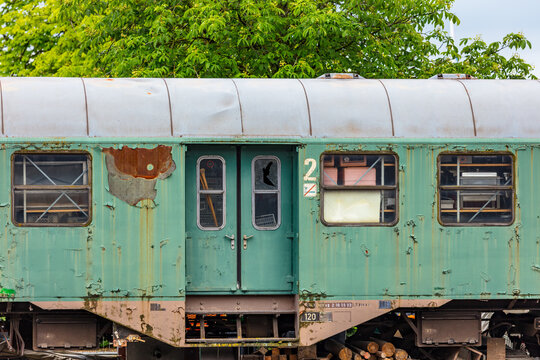
Where is `rusty window frame`? This screenshot has height=360, width=540. rusty window frame is located at coordinates (51, 189), (366, 187), (483, 189).